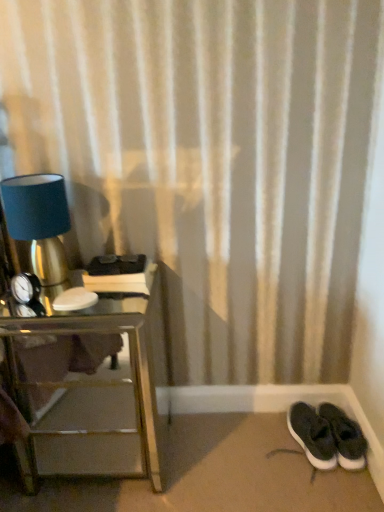
I want to click on free space to the left of black suede sneakers at lower right, so click(264, 442).